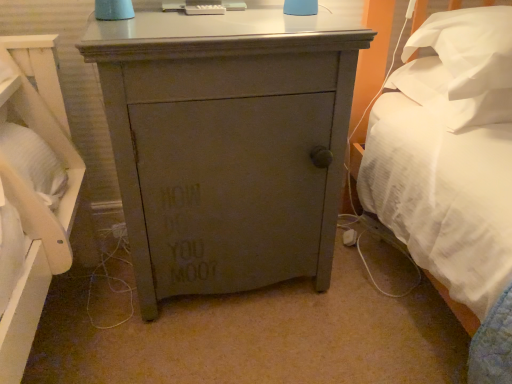
Question: Considering the relative sizes of matte gray cabinet at center and white soft pillow at upper right, marked as the second pillow in a bottom-to-top arrangement, in the image provided, is matte gray cabinet at center shorter than white soft pillow at upper right, marked as the second pillow in a bottom-to-top arrangement,?

Choices:
 (A) yes
 (B) no

Answer: (B)

Question: Considering the relative sizes of matte gray cabinet at center and white soft pillow at upper right, the first pillow in the top-to-bottom sequence, in the image provided, is matte gray cabinet at center smaller than white soft pillow at upper right, the first pillow in the top-to-bottom sequence,?

Choices:
 (A) no
 (B) yes

Answer: (A)

Question: Is matte gray cabinet at center in front of white soft pillow at upper right, marked as the second pillow in a bottom-to-top arrangement?

Choices:
 (A) yes
 (B) no

Answer: (A)

Question: Is matte gray cabinet at center oriented towards white soft pillow at upper right, marked as the second pillow in a bottom-to-top arrangement?

Choices:
 (A) yes
 (B) no

Answer: (B)

Question: Is matte gray cabinet at center wider than white soft pillow at upper right, marked as the second pillow in a bottom-to-top arrangement?

Choices:
 (A) yes
 (B) no

Answer: (A)

Question: Is matte gray cabinet at center positioned beyond the bounds of white soft pillow at upper right, the first pillow in the top-to-bottom sequence?

Choices:
 (A) yes
 (B) no

Answer: (A)

Question: Is matte gray cabinet at center outside white soft pillow at upper right, the 1th pillow when ordered from bottom to top?

Choices:
 (A) yes
 (B) no

Answer: (A)

Question: Does matte gray cabinet at center have a greater height compared to white soft pillow at upper right, the 2th pillow when ordered from top to bottom?

Choices:
 (A) no
 (B) yes

Answer: (B)

Question: Does matte gray cabinet at center have a greater width compared to white soft pillow at upper right, the 1th pillow when ordered from bottom to top?

Choices:
 (A) yes
 (B) no

Answer: (A)

Question: Is matte gray cabinet at center turned away from white soft pillow at upper right, the 2th pillow when ordered from top to bottom?

Choices:
 (A) yes
 (B) no

Answer: (B)

Question: Is white soft pillow at upper right, the 1th pillow when ordered from bottom to top, surrounded by matte gray cabinet at center?

Choices:
 (A) no
 (B) yes

Answer: (A)

Question: Can you confirm if matte gray cabinet at center is shorter than white soft pillow at upper right, the 2th pillow when ordered from top to bottom?

Choices:
 (A) yes
 (B) no

Answer: (B)

Question: Considering the relative sizes of white soft pillow at upper right, the 2th pillow when ordered from top to bottom, and matte gray cabinet at center in the image provided, is white soft pillow at upper right, the 2th pillow when ordered from top to bottom, shorter than matte gray cabinet at center?

Choices:
 (A) no
 (B) yes

Answer: (B)